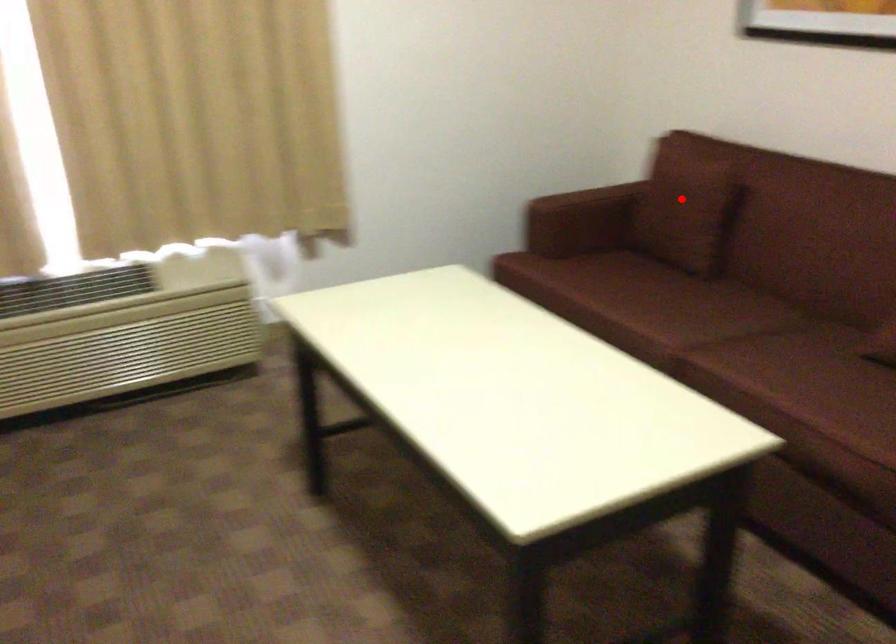
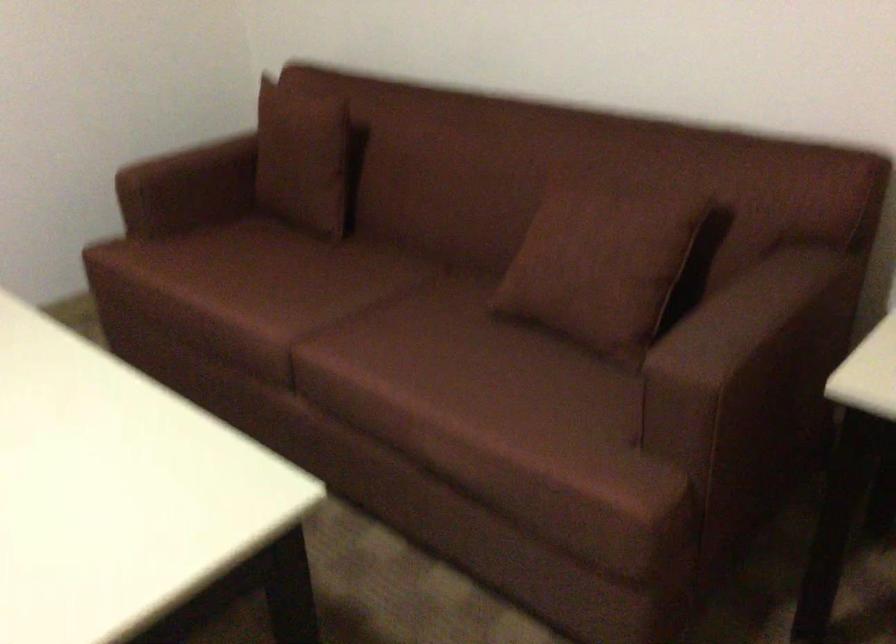
Find the pixel in the second image that matches the highlighted location in the first image.

(306, 158)